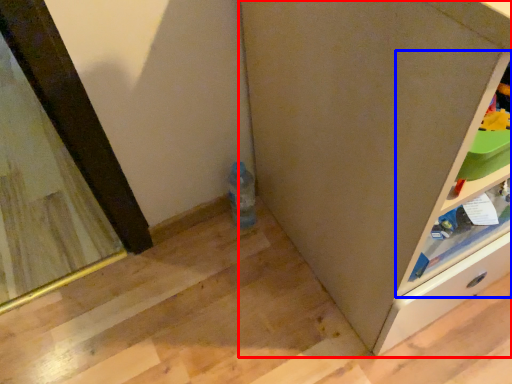
Question: Among these objects, which one is nearest to the camera, cabinetry (highlighted by a red box) or shelf (highlighted by a blue box)?

Choices:
 (A) cabinetry
 (B) shelf

Answer: (A)